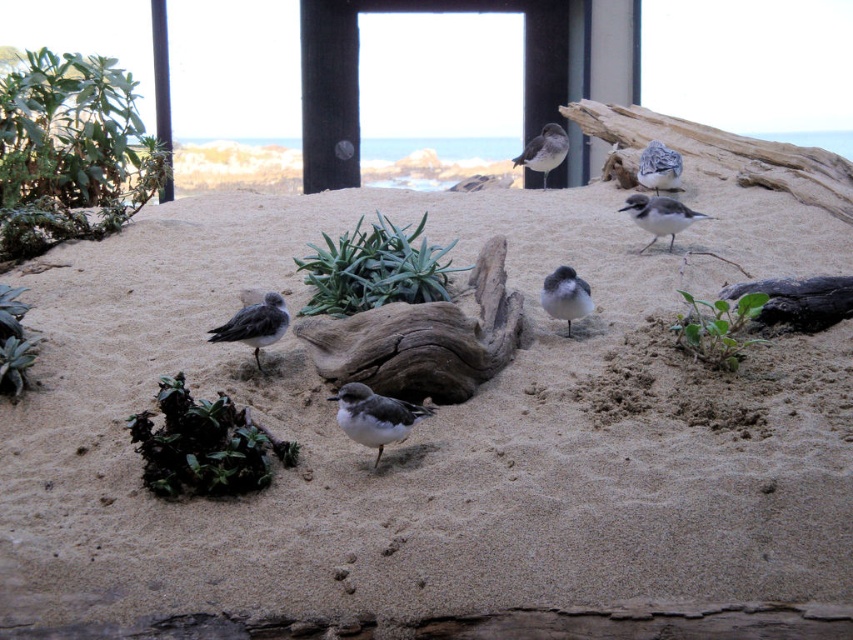
You are a zookeeper observing the enclosure. You notice the gray speckled bird at center and the sandy beach at center. Which object is located to the left of the other?

The gray speckled bird at center is to the left of the sandy beach at center because the sandy beach at center is positioned on the right side of the gray speckled bird at center.

What is located at the coordinates point (566, 296)?

At point (566, 296) lies white glossy bird at center.